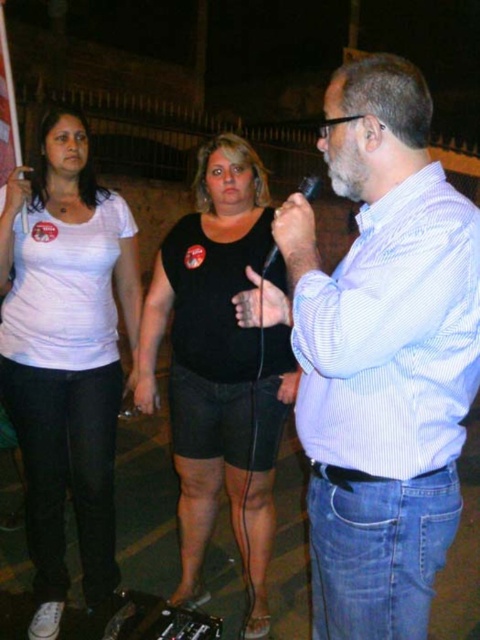
Question: Which point appears farthest from the camera in this image?

Choices:
 (A) (337, 449)
 (B) (58, 616)
 (C) (309, 180)
 (D) (231, 204)

Answer: (D)

Question: Can you confirm if white striped shirt at center is positioned below black matte tank top at center?

Choices:
 (A) no
 (B) yes

Answer: (A)

Question: Which point appears closest to the camera in this image?

Choices:
 (A) (44, 481)
 (B) (276, 420)

Answer: (A)

Question: Can you confirm if light blue striped shirt at center is positioned below black matte tank top at center?

Choices:
 (A) yes
 (B) no

Answer: (B)

Question: Which point appears farthest from the camera in this image?

Choices:
 (A) (250, 179)
 (B) (68, 195)
 (C) (312, 186)

Answer: (A)

Question: Can you confirm if white striped shirt at center is positioned above light blue striped shirt at center?

Choices:
 (A) yes
 (B) no

Answer: (B)